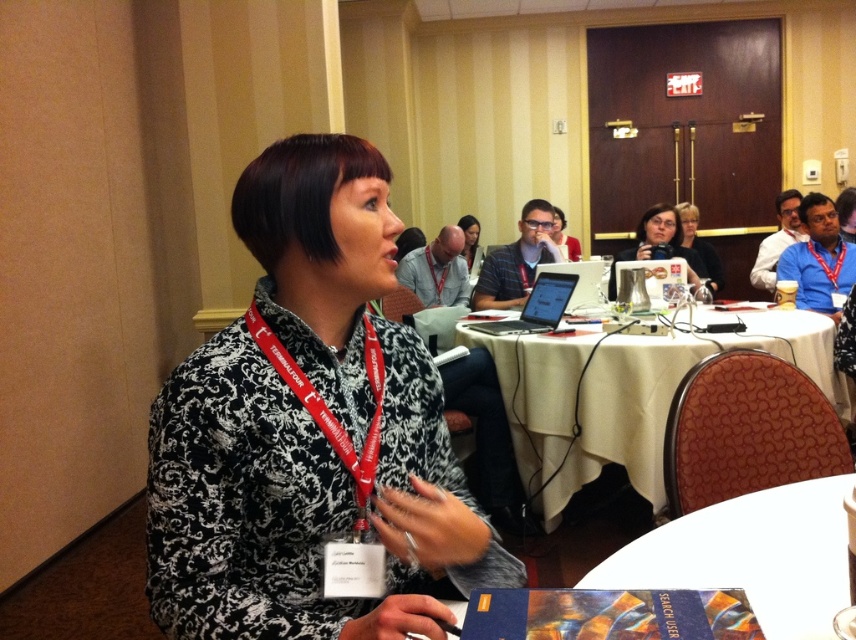
You are standing in the conference room and need to locate the blue lanyard at upper right. According to the coordinates given, where should you look?

The blue lanyard at upper right is located at point (818, 257).

You are sitting at a table in the conference room and want to reach a document placed at point (426, 541). There is a laptop at point (506, 332). Which point is closer to you, the document or the laptop?

The document at point (426, 541) is closer to you because it is in front of the laptop at point (506, 332).

You are an attendee at the conference and notice the blue lanyard at upper right and the matte black laptop at center. Which object is located closer to the bottom of the image?

The blue lanyard at upper right is positioned under the matte black laptop at center, meaning it is closer to the bottom of the image.